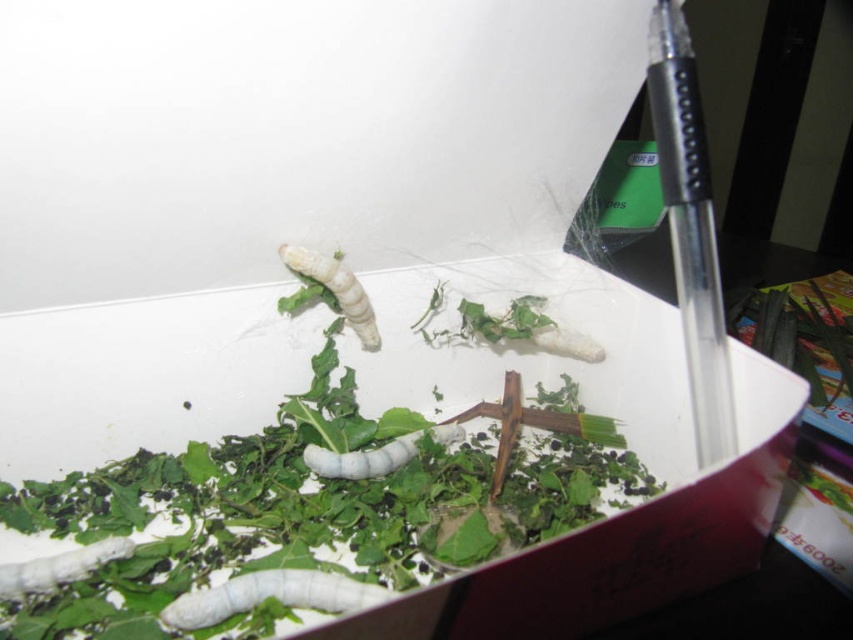
You are a silkworm caretaker and you need to place a new silkworm in the container. The container has a point marked at coordinate (x=801, y=333). Where would this point be located in relation to the green leafy plant at right?

The point (x=801, y=333) is on the green leafy plant at right.

You are a silkworm caretaker who needs to check the position of the white matte caterpillar at lower center relative to the green leafy plant at right. Is the caterpillar in front of or behind the plant?

The white matte caterpillar at lower center is behind the green leafy plant at right.

You are a caretaker of silkworms. You need to ensure that the white matte caterpillar at lower center has enough space to move around. Given the size of the green leafy plant at right, do you think the caterpillar can easily navigate around it?

The green leafy plant at right is larger in size than the white matte caterpillar at lower center, so the caterpillar may have some difficulty navigating around it but might still manage with care.